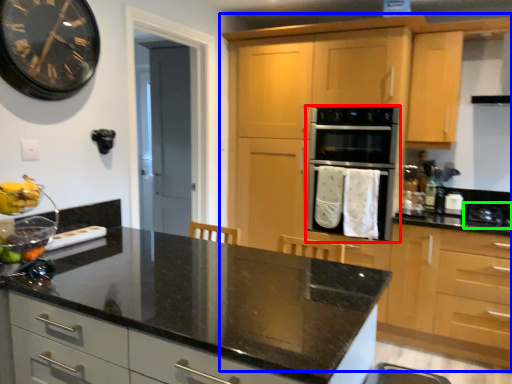
Question: Considering the real-world distances, which object is closest to oven (highlighted by a red box)? cabinetry (highlighted by a blue box) or gas stove (highlighted by a green box).

Choices:
 (A) cabinetry
 (B) gas stove

Answer: (A)